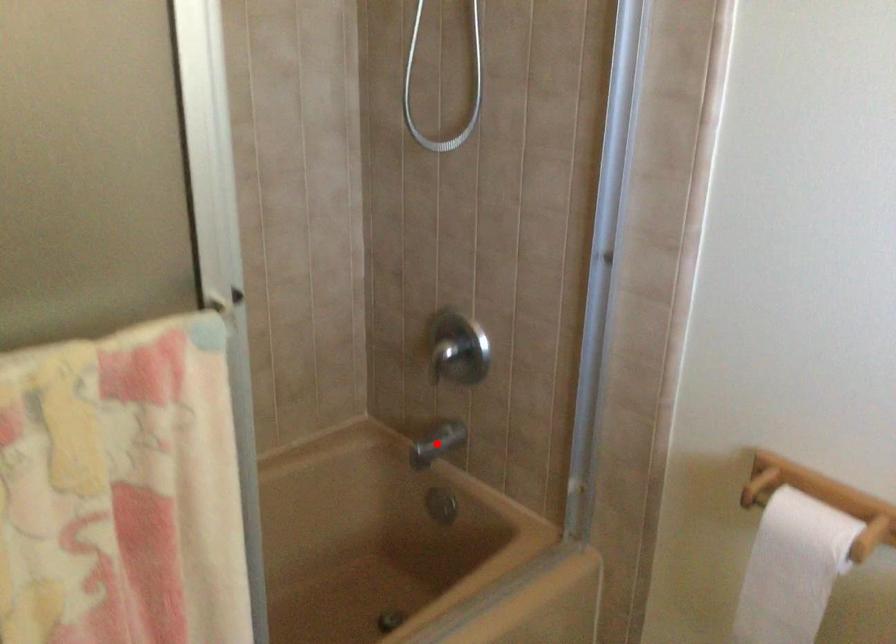
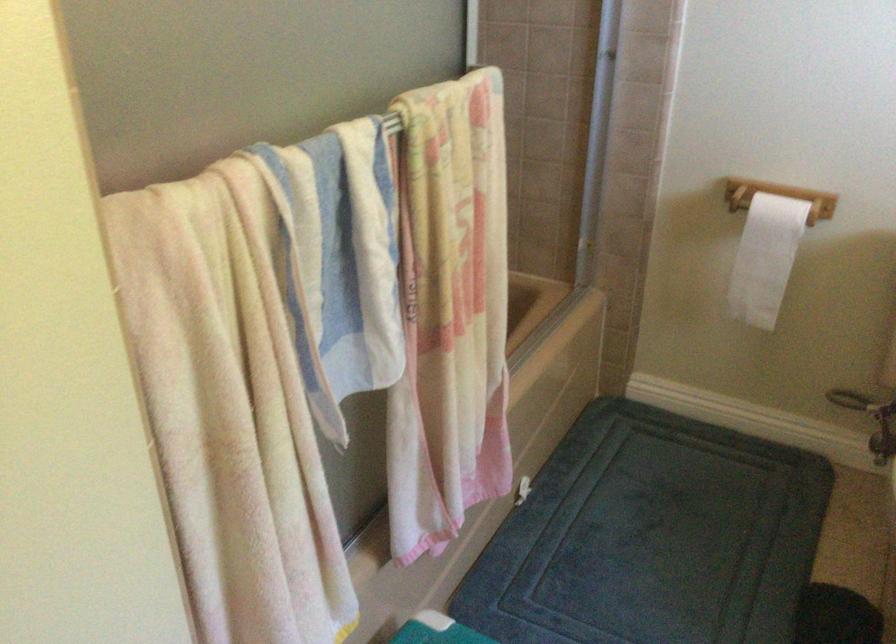
Question: I am providing you with two images of the same scene from different viewpoints. A red point is marked on the first image. Is the red point's position out of view in image 2?

Choices:
 (A) Yes
 (B) No

Answer: (A)